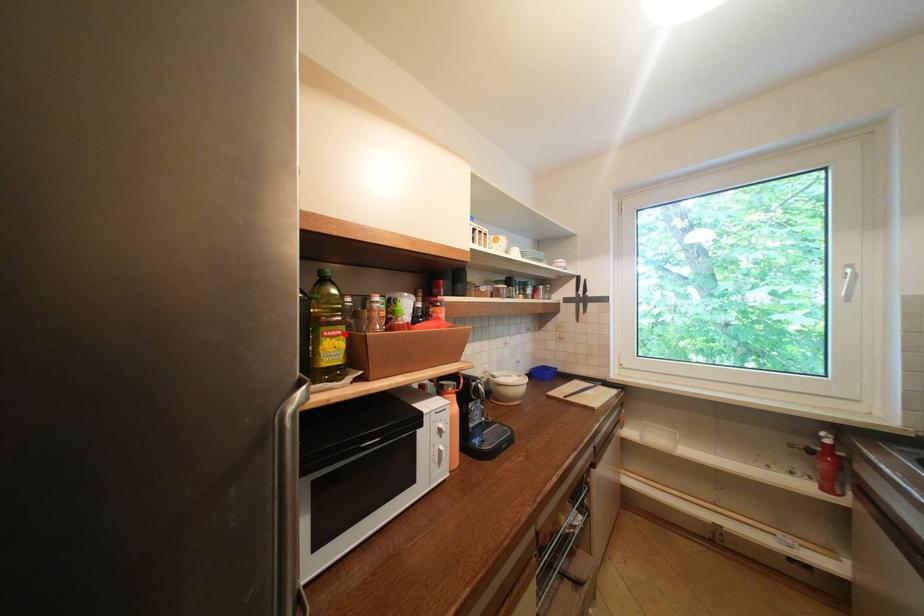
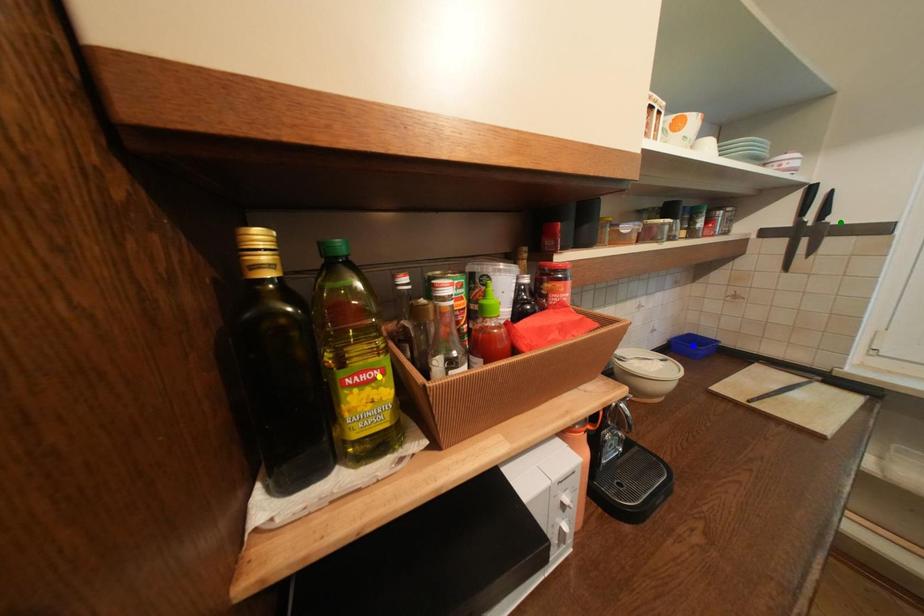
Question: I am providing you with two images of the same scene from different viewpoints. A red point is marked on the first image. You are given multiple points on the second image. Which point in image 2 represents the same 3d spot as the red point in image 1?

Choices:
 (A) green point
 (B) yellow point
 (C) blue point

Answer: (B)